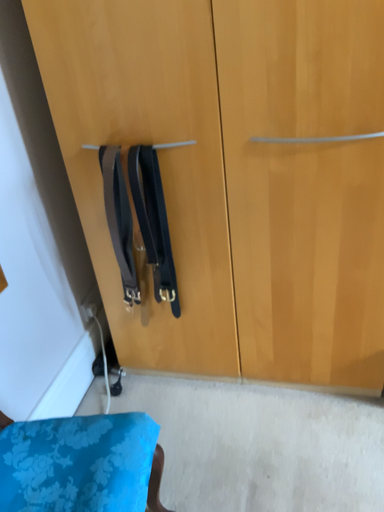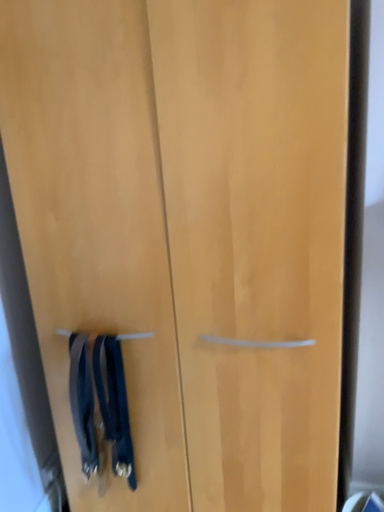
Question: Which way did the camera rotate in the video?

Choices:
 (A) rotated downward
 (B) rotated upward

Answer: (B)